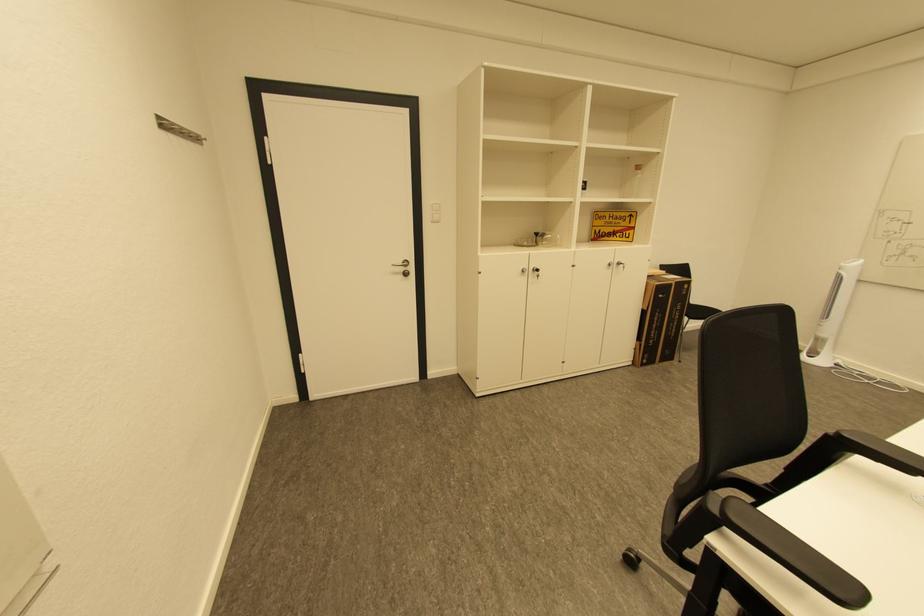
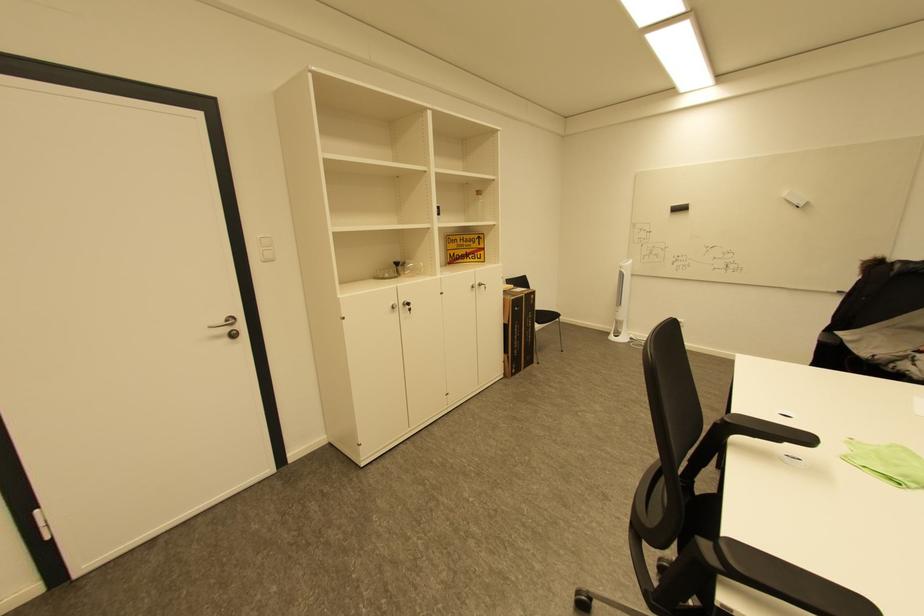
Locate, in the second image, the point that corresponds to (x=408, y=270) in the first image.

(233, 330)